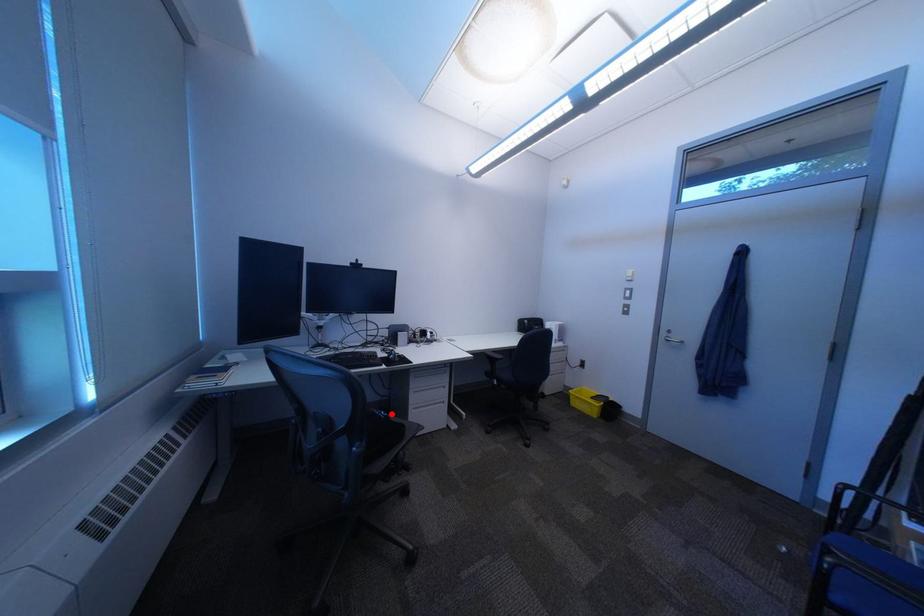
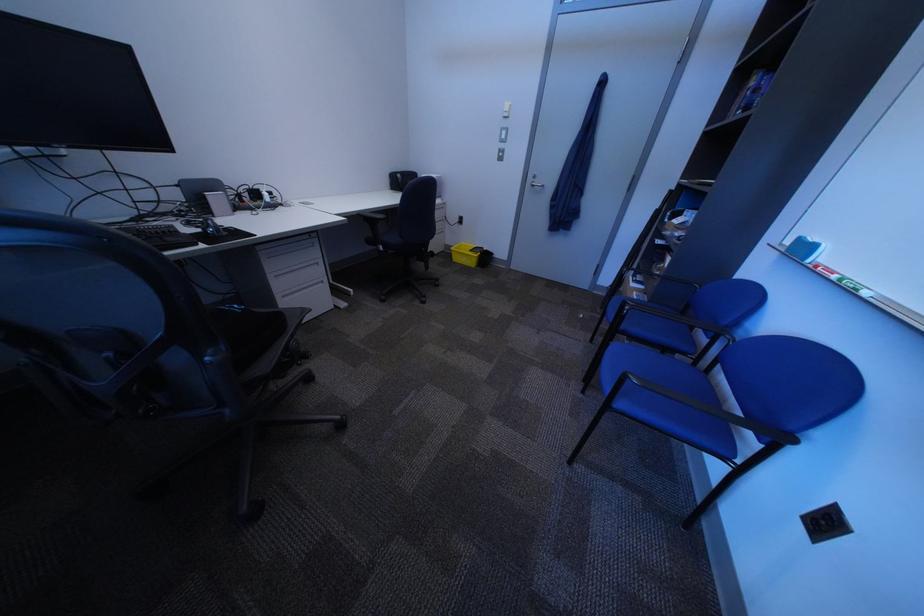
Question: I am providing you with two images of the same scene from different viewpoints. A red point is marked on the first image. Can you still see the location of the red point in image 2?

Choices:
 (A) Yes
 (B) No

Answer: (A)